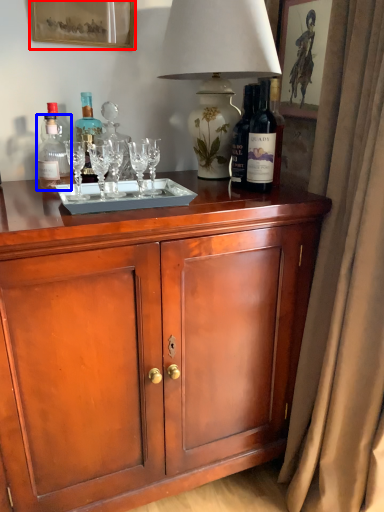
Question: Which object appears closest to the camera in this image, picture frame (highlighted by a red box) or bottle (highlighted by a blue box)?

Choices:
 (A) picture frame
 (B) bottle

Answer: (B)